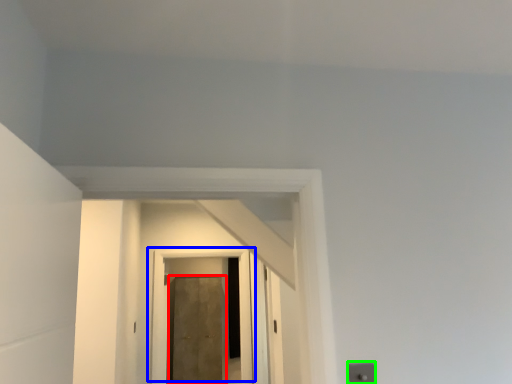
Question: Based on their relative distances, which object is nearer to door (highlighted by a red box)? Choose from door (highlighted by a blue box) and electric outlet (highlighted by a green box).

Choices:
 (A) door
 (B) electric outlet

Answer: (A)